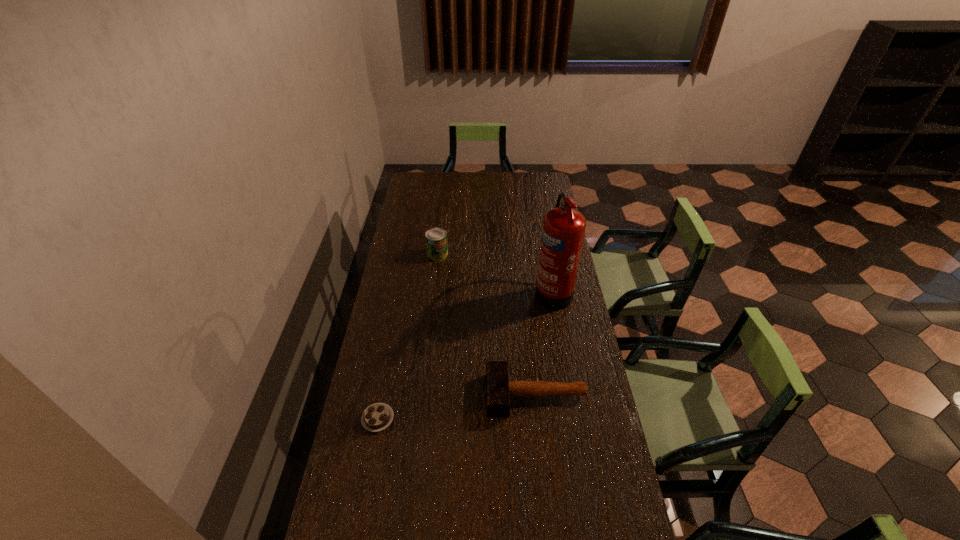
I want to click on free point between the third nearest object and the second object from left to right, so click(x=495, y=273).

This screenshot has height=540, width=960. Find the location of `vacant point located between the second object from left to right and the second shortest object`. vacant point located between the second object from left to right and the second shortest object is located at coordinates (487, 325).

Locate an element on the screen. This screenshot has width=960, height=540. free space that is in between the shortest object and the second farthest object is located at coordinates (466, 355).

You are a GUI agent. You are given a task and a screenshot of the screen. Output one action in this format:
    pyautogui.click(x=<x>, y=<y>)
    Task: Click on the object that is the closest one to the fire extinguisher
    This screenshot has width=960, height=540.
    Given the screenshot: What is the action you would take?
    pyautogui.click(x=499, y=389)

Choose which object is the nearest neighbor to the shortest object. Please provide its 2D coordinates. Your answer should be formatted as a tuple, i.e. [(x, y)], where the tuple contains the x and y coordinates of a point satisfying the conditions above.

[(499, 389)]